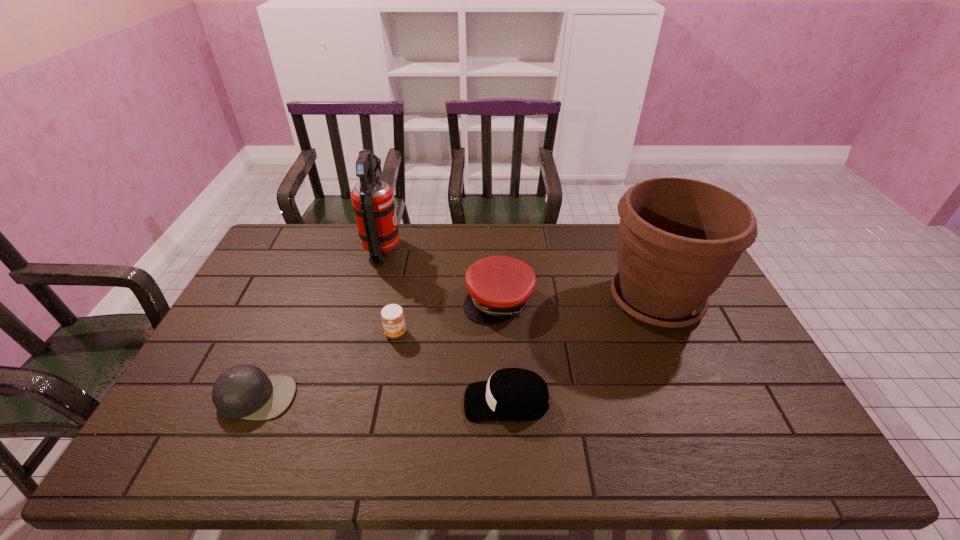
The image size is (960, 540). I want to click on object that is at the far edge, so click(372, 198).

At what (x,y) coordinates should I click in order to perform the action: click on object that is at the left edge. Please return your answer as a coordinate pair (x, y). This screenshot has width=960, height=540. Looking at the image, I should click on (244, 391).

The height and width of the screenshot is (540, 960). I want to click on object located at the right edge, so click(678, 239).

This screenshot has height=540, width=960. Identify the location of free location at the far edge of the desktop. (488, 233).

In the image, there is a desktop. Where is `vacant space at the left edge`? This screenshot has height=540, width=960. vacant space at the left edge is located at coordinates (275, 277).

The image size is (960, 540). In order to click on free space at the right edge of the desktop in this screenshot , I will do `click(740, 368)`.

Where is `vacant space at the far left corner of the desktop`? vacant space at the far left corner of the desktop is located at coordinates click(x=315, y=240).

This screenshot has height=540, width=960. In the image, there is a desktop. Find the location of `free space at the near right corner`. free space at the near right corner is located at coordinates (771, 446).

Locate an element on the screen. blank region between the leftmost object and the fire extinguisher is located at coordinates (320, 324).

Where is `free space that is in between the leftmost cap and the flowerpot`? Image resolution: width=960 pixels, height=540 pixels. free space that is in between the leftmost cap and the flowerpot is located at coordinates (456, 348).